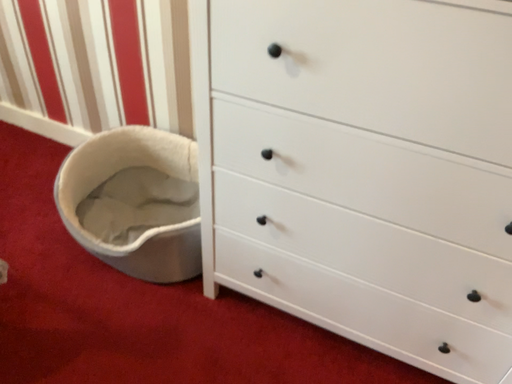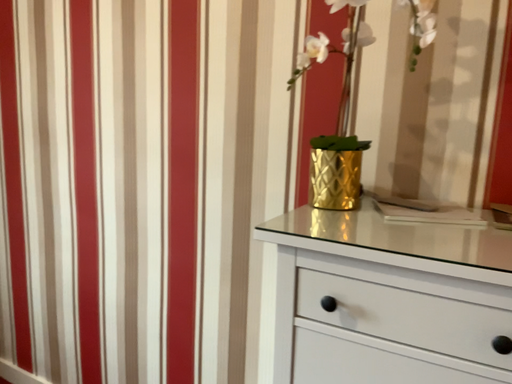
Question: Which way did the camera rotate in the video?

Choices:
 (A) rotated downward
 (B) rotated upward

Answer: (B)